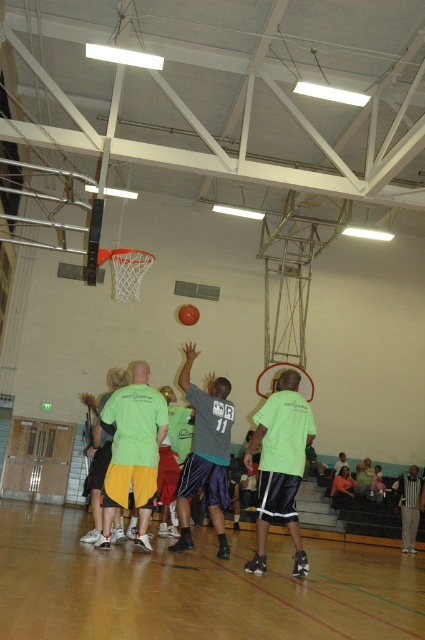
You are a photographer standing at the edge of the gymnasium. You want to take a photo that includes both the wooden floor at lower center and the green jersey at center. Which object should you focus on first to ensure both are in frame?

The wooden floor at lower center is bigger than the green jersey at center, so you should focus on the wooden floor at lower center first to ensure both are in frame.

You are a referee observing the basketball game. You notice the green jersey at center and the orange rubber basketball at center. Which object is taller?

The green jersey at center is taller than the orange rubber basketball at center.